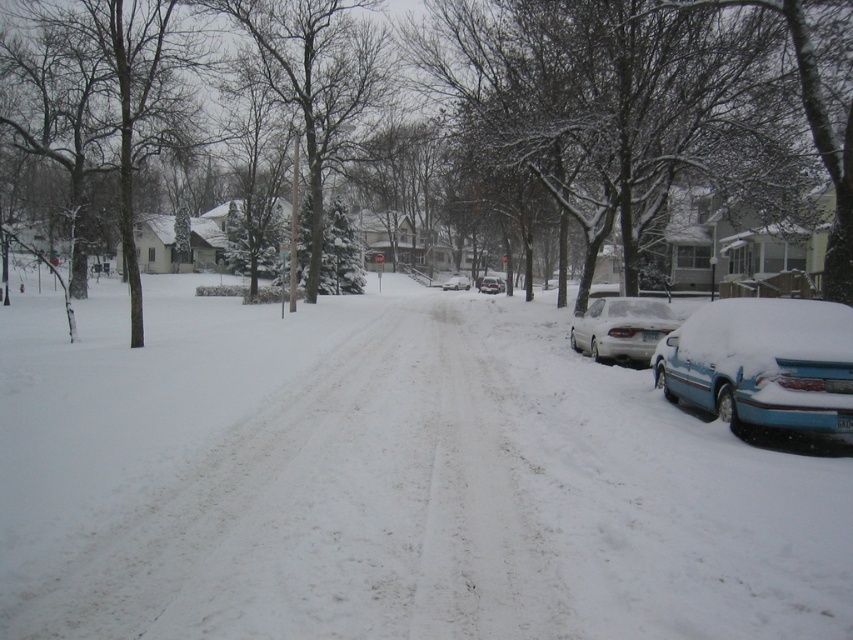
You are a delivery person trying to deliver a package to the address located at the center of the snowy street. The path is partially covered by the white fluffy snow at center and the sleek silver sedan at center. Which object is wider, making it harder to navigate around?

The white fluffy snow at center is wider than the sleek silver sedan at center, so it would be harder to navigate around due to its larger width.

You are standing at the point labeled point [654,305] and want to walk to the point labeled point [96,442]. Given the snowy terrain, can you safely walk directly towards your destination without encountering any obstacles?

The point labeled point [96,442] is in front of point [654,305], so there are no obstacles between them. Therefore, you can safely walk directly towards your destination without encountering any obstacles.